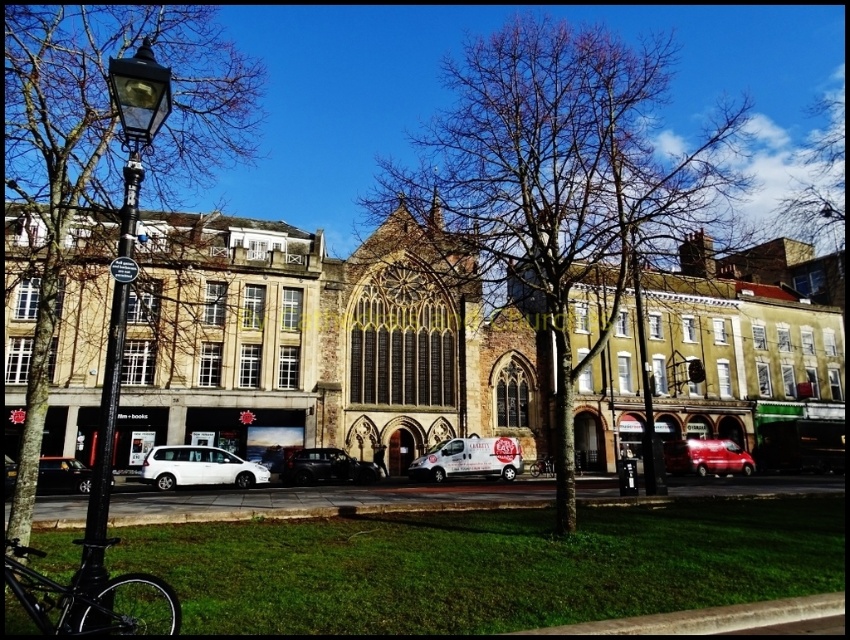
You are a photographer planning to capture the historic church in the center. You notice the bare branches at center and the matte white van at lower left in the frame. Which object occupies more horizontal space in the image?

The bare branches at center occupies more horizontal space than the matte white van at lower left because its width is larger.